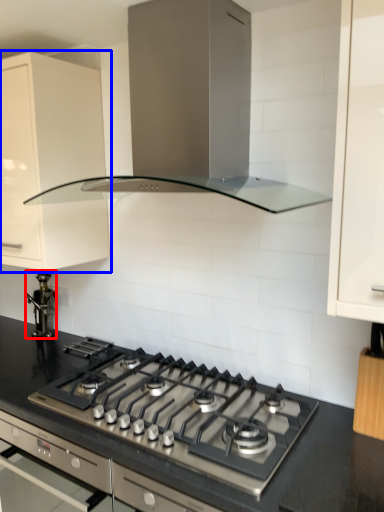
Question: Which point is closer to the camera, appliance (highlighted by a red box) or cabinetry (highlighted by a blue box)?

Choices:
 (A) appliance
 (B) cabinetry

Answer: (B)